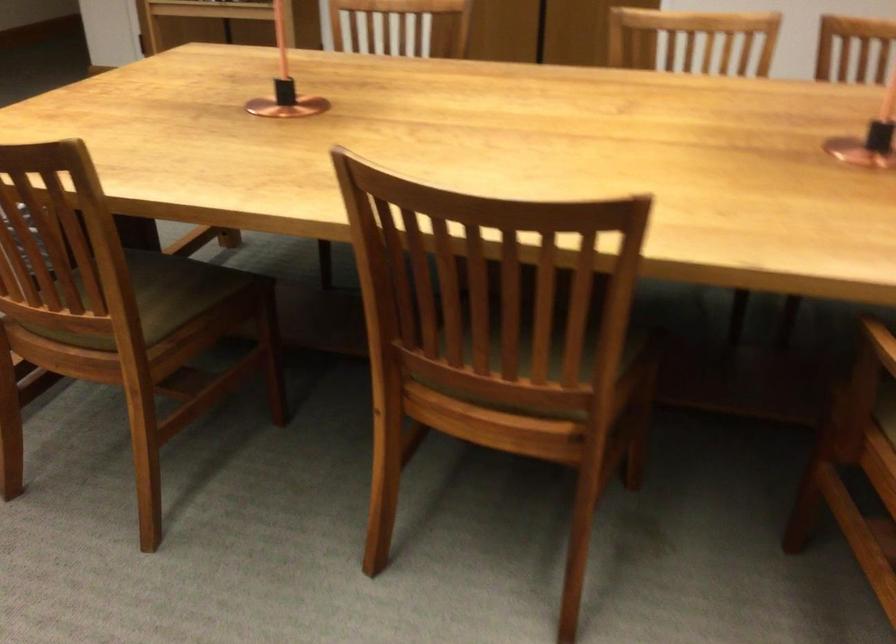
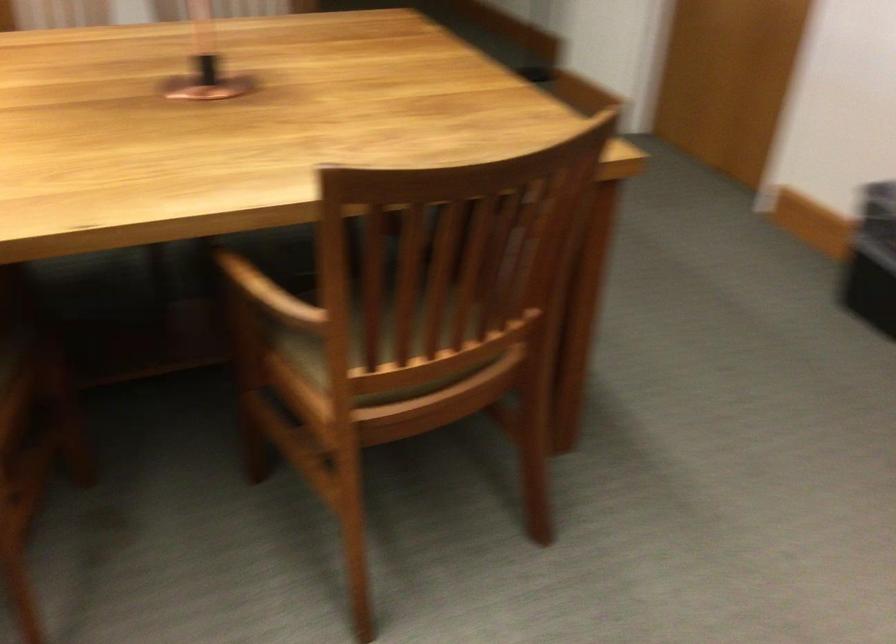
Question: How did the camera likely rotate?

Choices:
 (A) Left
 (B) Right
 (C) Up
 (D) Down

Answer: (B)